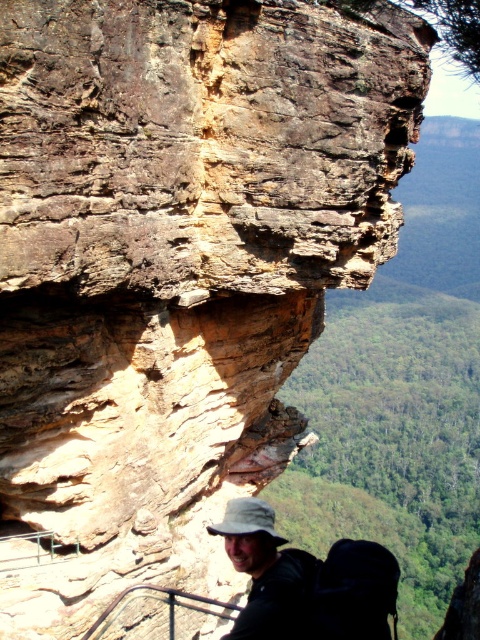
Question: Does matte khaki hat at lower center come behind khaki fabric hat at center?

Choices:
 (A) yes
 (B) no

Answer: (A)

Question: Can you confirm if matte khaki hat at lower center is positioned to the left of khaki fabric hat at center?

Choices:
 (A) yes
 (B) no

Answer: (B)

Question: Which object appears farthest from the camera in this image?

Choices:
 (A) matte khaki hat at lower center
 (B) khaki fabric hat at center

Answer: (A)

Question: Does matte khaki hat at lower center appear on the left side of khaki fabric hat at center?

Choices:
 (A) yes
 (B) no

Answer: (B)

Question: Which point is farther from the camera taking this photo?

Choices:
 (A) (264, 525)
 (B) (250, 568)

Answer: (A)

Question: Which point appears farthest from the camera in this image?

Choices:
 (A) (288, 596)
 (B) (259, 512)

Answer: (B)